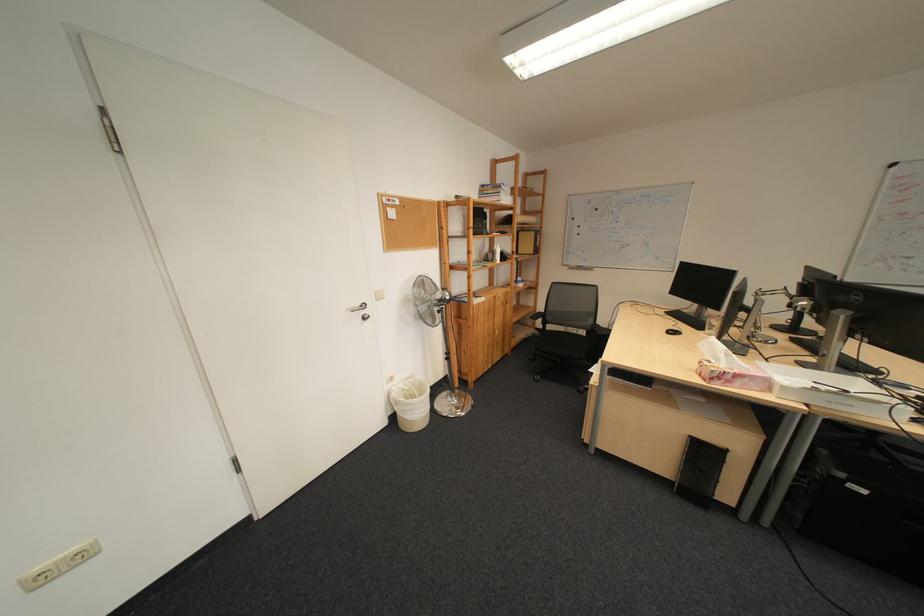
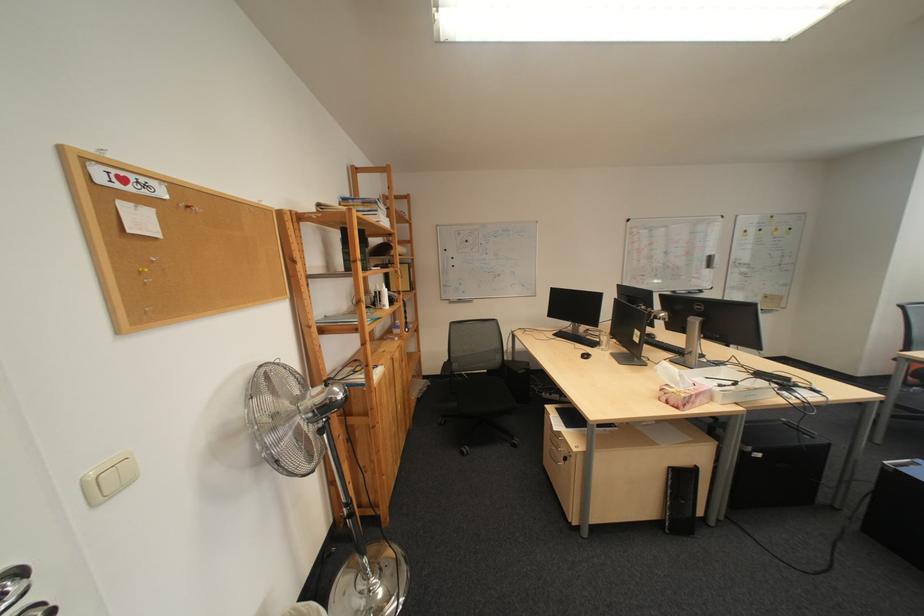
Question: The camera is either moving clockwise (left) or counter-clockwise (right) around the object. The first image is from the beginning of the video and the second image is from the end. Is the camera moving left or right when shooting the video?

Choices:
 (A) Left
 (B) Right

Answer: (A)